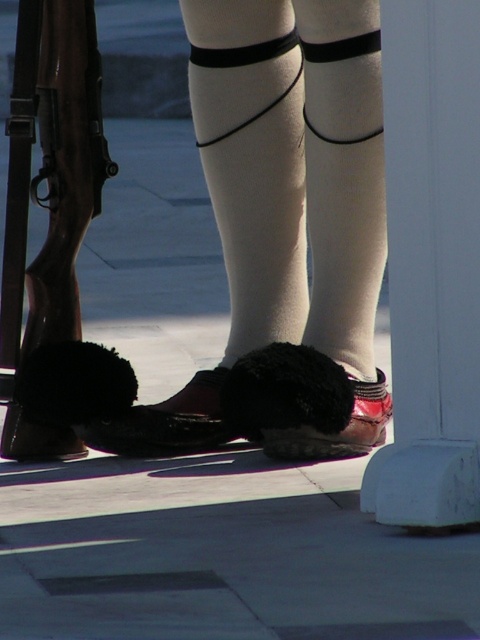
Does point (262, 157) come in front of point (391, 408)?

That is True.

Between white smooth socks at center and shiny black shoe at center, which one is positioned higher?

white smooth socks at center is higher up.

Find the location of a particular element. The width and height of the screenshot is (480, 640). white smooth socks at center is located at coordinates (237, 205).

At what (x,y) coordinates should I click in order to perform the action: click on shiny black shoe at center. Please return your answer as a coordinate pair (x, y). Image resolution: width=480 pixels, height=640 pixels. Looking at the image, I should click on (303, 404).

Is point (241, 417) in front of point (178, 397)?

Yes, it is.

At what (x,y) coordinates should I click in order to perform the action: click on shiny black shoe at center. Please return your answer as a coordinate pair (x, y). The image size is (480, 640). Looking at the image, I should click on (303, 404).

Is white smooth socks at center in front of wooden stock shotgun at left?

That is False.

Is point (276, 109) closer to viewer compared to point (61, 196)?

No, it is not.

Is point (297, 212) less distant than point (41, 316)?

No, it is behind (41, 316).

This screenshot has height=640, width=480. I want to click on white smooth socks at center, so (x=237, y=205).